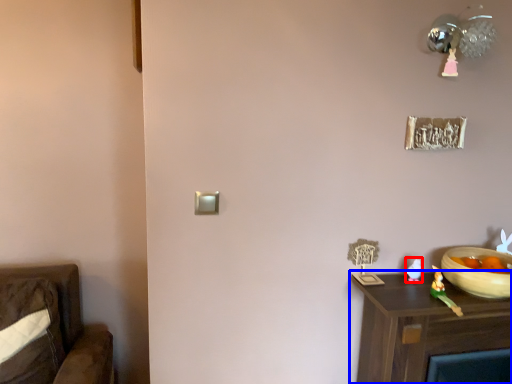
Question: Which object appears closest to the camera in this image, toy (highlighted by a red box) or nightstand (highlighted by a blue box)?

Choices:
 (A) toy
 (B) nightstand

Answer: (B)